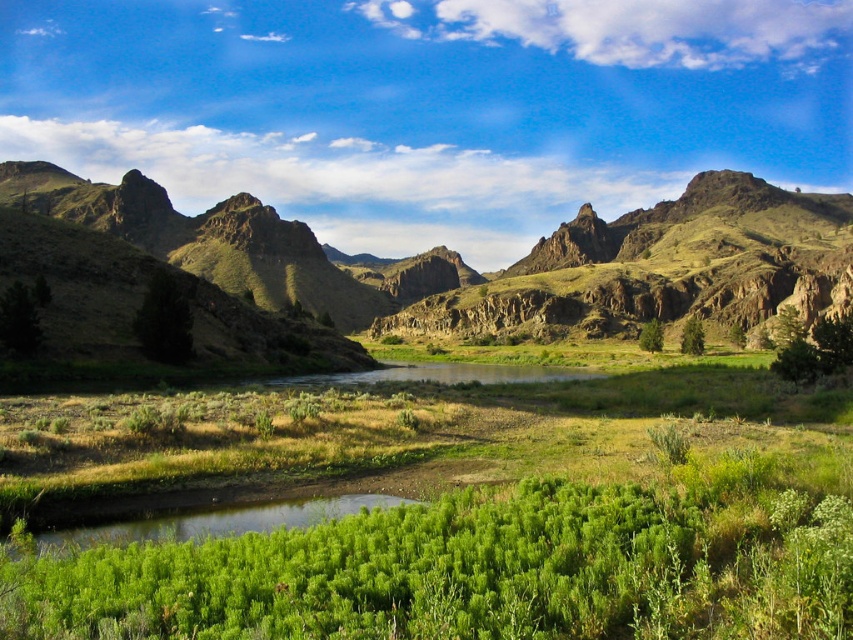
You are a hiker trying to navigate through the green leafy shrubs at center and the green leafy shrub at center. Which one is shorter?

The green leafy shrubs at center is not as tall as the green leafy shrub at center, so the green leafy shrubs at center is shorter.

You are planning a hiking trip and need to decide between two landmarks in the image. The first is the green rocky mountains at center and the second is the green leafy shrub at center. Which landmark is larger in size?

The green rocky mountains at center is bigger than the green leafy shrub at center according to the description provided.

You are a hiker trying to navigate through the landscape. You see the green rocky mountains at center and the green leafy shrub at center. Which object is closer to you?

The green rocky mountains at center are closer to the viewer than the green leafy shrub at center.